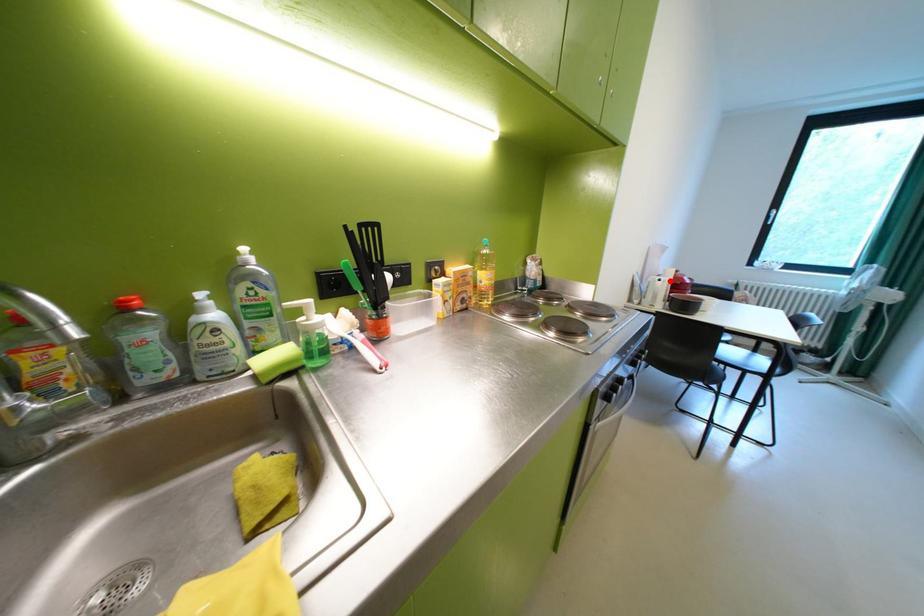
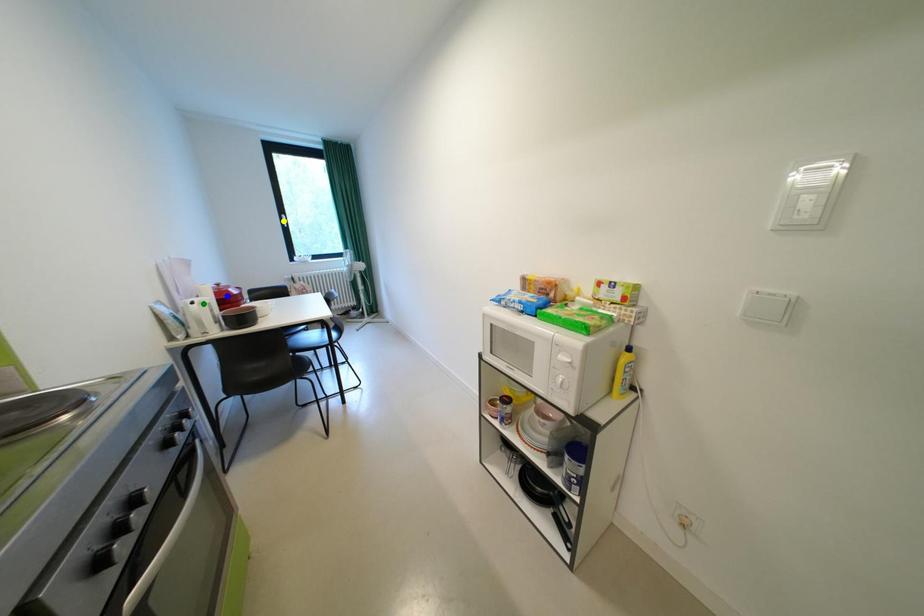
Question: I am providing you with two images of the same scene from different viewpoints. A red point is marked on the first image. You are given multiple points on the second image. In image 2, which mark is for the same physical point as the one in image 1?

Choices:
 (A) blue point
 (B) green point
 (C) yellow point

Answer: (B)